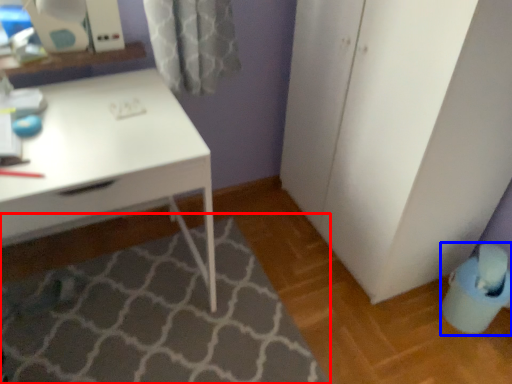
Question: Which of the following is the closest to the observer, bath mat (highlighted by a red box) or swivel chair (highlighted by a blue box)?

Choices:
 (A) bath mat
 (B) swivel chair

Answer: (A)